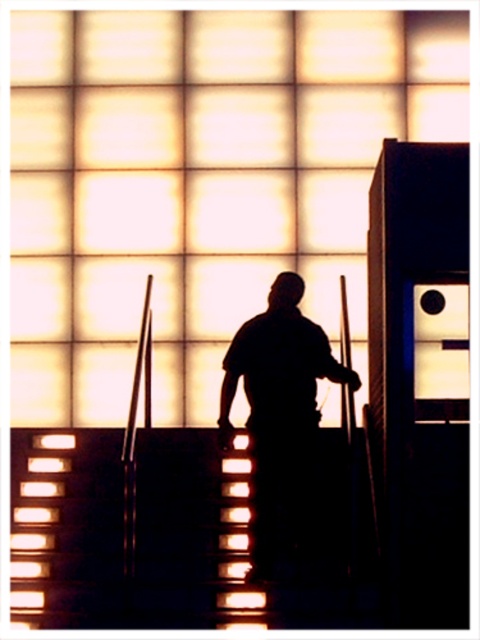
Question: Does black matte figure at center have a smaller size compared to metallic stairwell at center?

Choices:
 (A) yes
 (B) no

Answer: (B)

Question: Which of the following is the farthest from the observer?

Choices:
 (A) coord(222,534)
 (B) coord(264,317)

Answer: (A)

Question: Is black matte figure at center bigger than metallic stairwell at center?

Choices:
 (A) yes
 (B) no

Answer: (A)

Question: Which object appears closest to the camera in this image?

Choices:
 (A) black matte figure at center
 (B) metallic stairwell at center

Answer: (B)

Question: Does black matte figure at center lie behind metallic stairwell at center?

Choices:
 (A) yes
 (B) no

Answer: (A)